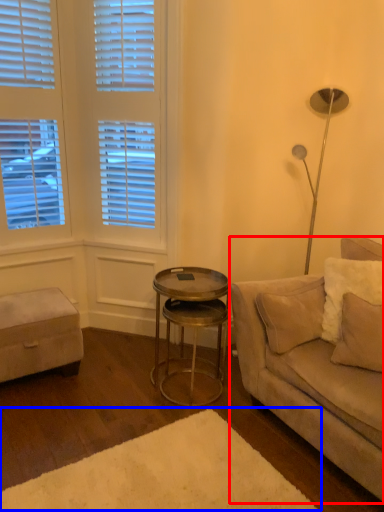
Question: Which of the following is the farthest to the observer, studio couch (highlighted by a red box) or plain (highlighted by a blue box)?

Choices:
 (A) studio couch
 (B) plain

Answer: (A)